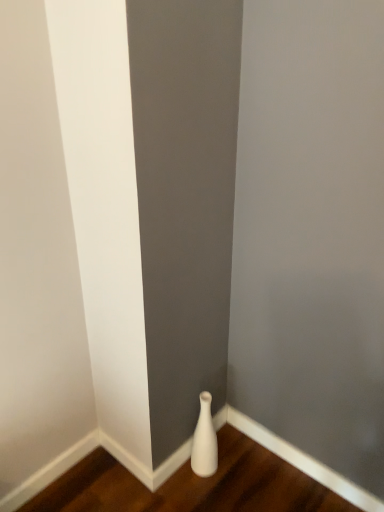
The width and height of the screenshot is (384, 512). I want to click on shiny brown hardwood at lower center, so click(192, 485).

What do you see at coordinates (192, 485) in the screenshot?
I see `shiny brown hardwood at lower center` at bounding box center [192, 485].

In order to face shiny brown hardwood at lower center, should I rotate leftwards or rightwards?

Turn right approximately 0.579 degrees to face it.

Describe the element at coordinates (204, 440) in the screenshot. The height and width of the screenshot is (512, 384). I see `white matte vase at lower right` at that location.

Identify the location of white matte vase at lower right. (204, 440).

This screenshot has width=384, height=512. I want to click on shiny brown hardwood at lower center, so click(x=192, y=485).

Would you say white matte vase at lower right is to the left or to the right of shiny brown hardwood at lower center in the picture?

From the image, it's evident that white matte vase at lower right is to the right of shiny brown hardwood at lower center.

Is the depth of white matte vase at lower right less than that of shiny brown hardwood at lower center?

No, white matte vase at lower right is further to the viewer.

Does point (210, 453) appear closer or farther from the camera than point (57, 490)?

Point (210, 453) is positioned farther from the camera compared to point (57, 490).

From the image's perspective, is white matte vase at lower right located beneath shiny brown hardwood at lower center?

Actually, white matte vase at lower right appears above shiny brown hardwood at lower center in the image.

From a real-world perspective, is white matte vase at lower right above or below shiny brown hardwood at lower center?

Clearly, from a real-world perspective, white matte vase at lower right is above shiny brown hardwood at lower center.

Can you confirm if white matte vase at lower right is wider than shiny brown hardwood at lower center?

Incorrect, the width of white matte vase at lower right does not surpass that of shiny brown hardwood at lower center.

Considering the relative sizes of white matte vase at lower right and shiny brown hardwood at lower center in the image provided, is white matte vase at lower right taller than shiny brown hardwood at lower center?

Indeed, white matte vase at lower right has a greater height compared to shiny brown hardwood at lower center.

Considering the relative sizes of white matte vase at lower right and shiny brown hardwood at lower center in the image provided, is white matte vase at lower right bigger than shiny brown hardwood at lower center?

Incorrect, white matte vase at lower right is not larger than shiny brown hardwood at lower center.

Is white matte vase at lower right located outside shiny brown hardwood at lower center?

Yes, white matte vase at lower right is not within shiny brown hardwood at lower center.

Is white matte vase at lower right directly adjacent to shiny brown hardwood at lower center?

No.

Is white matte vase at lower right facing towards shiny brown hardwood at lower center?

No, white matte vase at lower right does not turn towards shiny brown hardwood at lower center.

The height and width of the screenshot is (512, 384). Identify the location of vase that appears on the right of shiny brown hardwood at lower center. (204, 440).

Considering the relative positions of shiny brown hardwood at lower center and white matte vase at lower right in the image provided, is shiny brown hardwood at lower center to the left of white matte vase at lower right from the viewer's perspective?

Yes.

Does shiny brown hardwood at lower center lie behind white matte vase at lower right?

No, it is in front of white matte vase at lower right.

Which is farther from the camera, (129, 486) or (201, 459)?

Point (201, 459)

From the image's perspective, between shiny brown hardwood at lower center and white matte vase at lower right, who is located below?

shiny brown hardwood at lower center, from the image's perspective.

From a real-world perspective, who is located higher, shiny brown hardwood at lower center or white matte vase at lower right?

white matte vase at lower right.

Can you confirm if shiny brown hardwood at lower center is wider than white matte vase at lower right?

Yes.

Who is taller, shiny brown hardwood at lower center or white matte vase at lower right?

Answer: With more height is white matte vase at lower right.

Considering the sizes of shiny brown hardwood at lower center and white matte vase at lower right in the image, is shiny brown hardwood at lower center bigger or smaller than white matte vase at lower right?

shiny brown hardwood at lower center is bigger than white matte vase at lower right.

Does shiny brown hardwood at lower center contain white matte vase at lower right?

That's incorrect, white matte vase at lower right is not inside shiny brown hardwood at lower center.

Can you see shiny brown hardwood at lower center touching white matte vase at lower right?

No, shiny brown hardwood at lower center is not in contact with white matte vase at lower right.

Is shiny brown hardwood at lower center aimed at white matte vase at lower right?

No.

How different are the orientations of shiny brown hardwood at lower center and white matte vase at lower right in degrees?

The angle between the facing direction of shiny brown hardwood at lower center and the facing direction of white matte vase at lower right is 180 degrees.

Looking at this image, measure the distance between shiny brown hardwood at lower center and white matte vase at lower right.

shiny brown hardwood at lower center is 8.54 inches away from white matte vase at lower right.

Identify the location of vase on the right of the shiny brown hardwood at lower center. Image resolution: width=384 pixels, height=512 pixels. (204, 440).

Find the location of a particular element. vase above the shiny brown hardwood at lower center (from the image's perspective) is located at coordinates (204, 440).

Where is `hardwood below the white matte vase at lower right (from the image's perspective)`? This screenshot has width=384, height=512. hardwood below the white matte vase at lower right (from the image's perspective) is located at coordinates (192, 485).